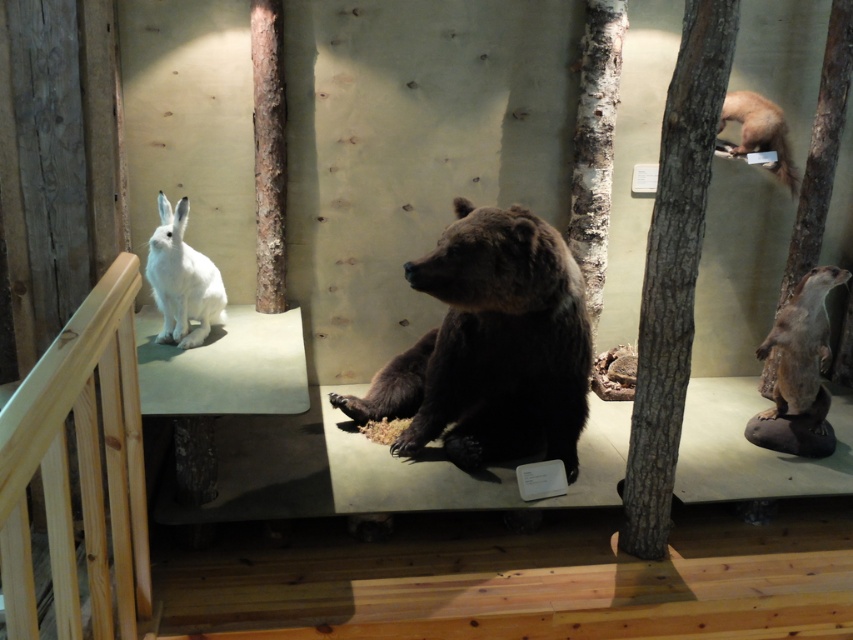
From the picture: In the museum exhibit, where is the white fur rabbit at left located in relation to the brown bear? Please provide coordinates in the format of x,y between 0 and 1, with 0,0 being the bottom left corner and 1,1 the top right corner.

The white fur rabbit at left is located at coordinates (181, 280).

You are a visitor standing in front of the diorama exhibit. You see the brown fur bear at center and the white fur otter at right. Which animal is positioned to the left side of the other?

The brown fur bear at center is positioned to the left of the white fur otter at right.